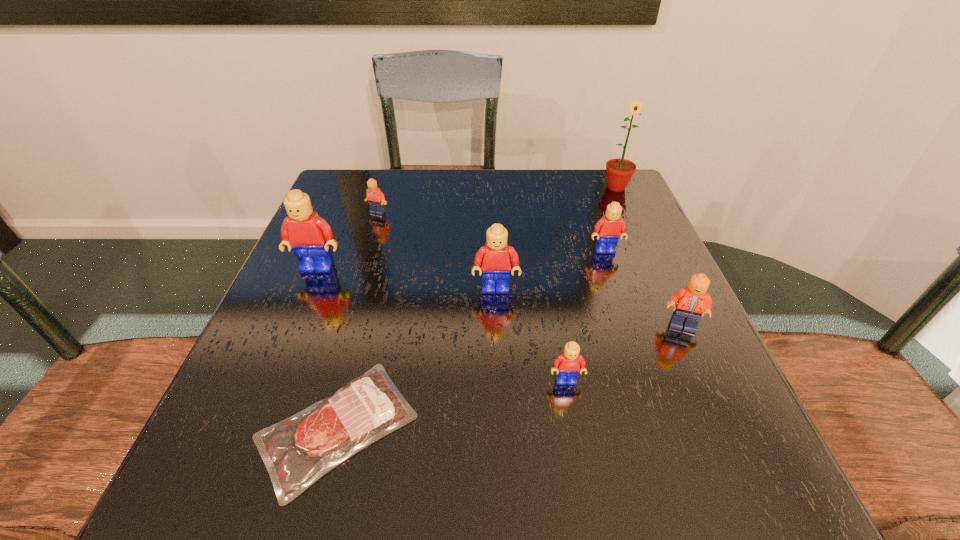
Where is `unoccupied position between the steak and the fifth Lego from right to left`? unoccupied position between the steak and the fifth Lego from right to left is located at coordinates (357, 320).

Identify the location of vacant space that is in between the fourth object from left to right and the third farthest Lego. The image size is (960, 540). (407, 278).

You are a GUI agent. You are given a task and a screenshot of the screen. Output one action in this format:
    pyautogui.click(x=<x>, y=<y>)
    Task: Click on the free space that is in between the second farthest object and the rightmost Lego
    Image resolution: width=960 pixels, height=540 pixels.
    Given the screenshot: What is the action you would take?
    530,269

Find the location of a particular element. unoccupied position between the green sunflower and the sixth shortest object is located at coordinates (556, 238).

This screenshot has height=540, width=960. I want to click on vacant region between the third biggest yellow Lego and the leftmost Lego, so click(462, 259).

The width and height of the screenshot is (960, 540). Find the location of `vacant point located between the fifth farthest Lego and the steak`. vacant point located between the fifth farthest Lego and the steak is located at coordinates (510, 376).

The height and width of the screenshot is (540, 960). Find the location of `free space between the farther orange Lego and the fourth object from left to right`. free space between the farther orange Lego and the fourth object from left to right is located at coordinates (437, 251).

Find the location of `the sixth closest object relative to the seventh nearest object`. the sixth closest object relative to the seventh nearest object is located at coordinates (567, 365).

Locate an element on the screen. The width and height of the screenshot is (960, 540). object that is the fourth closest one to the third farthest yellow Lego is located at coordinates (692, 301).

Identify which Lego is located as the fourth nearest to the third Lego from left to right. Please provide its 2D coordinates. Your answer should be formatted as a tuple, i.e. [(x, y)], where the tuple contains the x and y coordinates of a point satisfying the conditions above.

[(309, 235)]